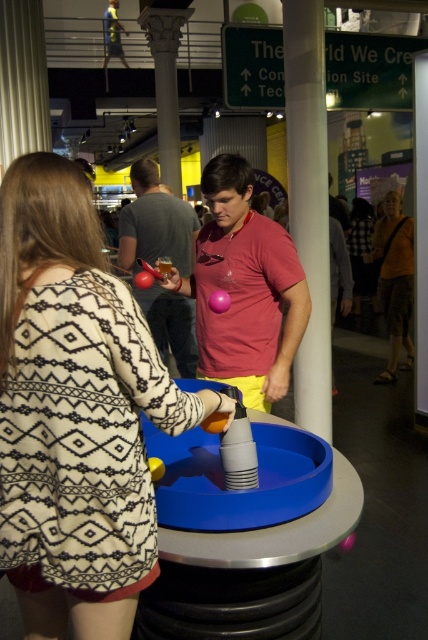
Between pink rubber ball at center and matte pink ball at center, which one has more height?

Standing taller between the two is matte pink ball at center.

Is pink rubber ball at center shorter than matte pink ball at center?

Yes, pink rubber ball at center is shorter than matte pink ball at center.

Is point (211, 198) less distant than point (157, 195)?

Yes, it is in front of point (157, 195).

Where is `pink rubber ball at center`? The image size is (428, 640). pink rubber ball at center is located at coordinates (244, 289).

Which is more to the right, pink rubber ball at center or orange fabric shirt at right?

orange fabric shirt at right

Between pink rubber ball at center and orange fabric shirt at right, which one has more height?

Standing taller between the two is orange fabric shirt at right.

Which is behind, point (234, 320) or point (407, 228)?

Point (407, 228)

Locate an element on the screen. The width and height of the screenshot is (428, 640). pink rubber ball at center is located at coordinates (244, 289).

Is point (190, 243) positioned before point (388, 369)?

Yes, it is.

Find the location of `matte pink ball at center`. matte pink ball at center is located at coordinates (155, 224).

This screenshot has height=640, width=428. Find the location of `matte pink ball at center`. matte pink ball at center is located at coordinates (155, 224).